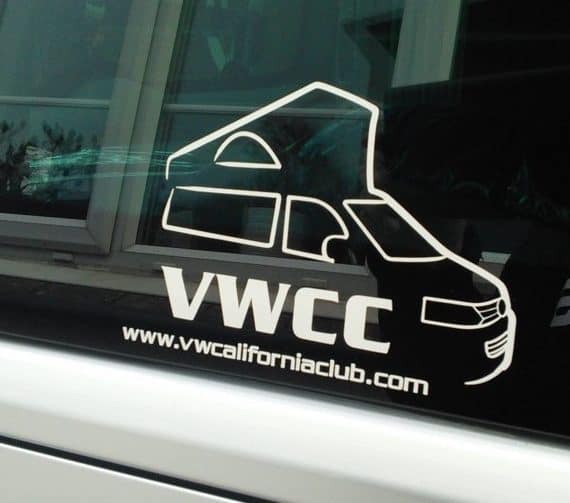
This screenshot has height=503, width=570. I want to click on window, so click(75, 320).